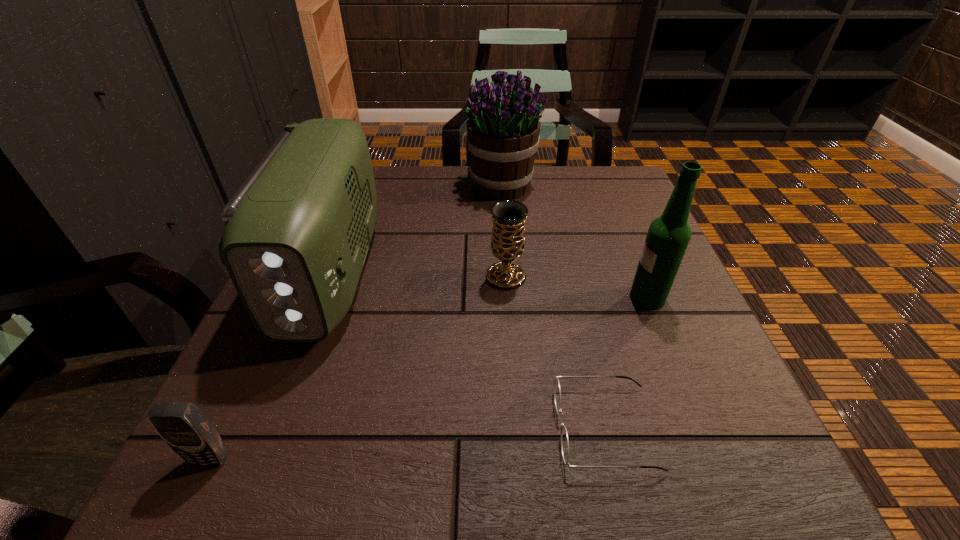
Locate an element on the screen. This screenshot has width=960, height=540. free spot located on the front-facing side of the radio_receiver is located at coordinates coord(279,407).

Where is `free space located 0.060m on the left of the fourth tallest object`? The image size is (960, 540). free space located 0.060m on the left of the fourth tallest object is located at coordinates (456, 276).

Locate an element on the screen. free space located on the front-facing side of the spectacles is located at coordinates (507, 428).

I want to click on free region located 0.250m on the front-facing side of the spectacles, so click(383, 428).

Find the location of a particular element. vacant space located 0.160m on the front-facing side of the spectacles is located at coordinates (445, 428).

Where is `bouquet present at the far edge`? bouquet present at the far edge is located at coordinates (503, 128).

At what (x,y) coordinates should I click in order to perform the action: click on radio_receiver located at the far edge. Please return your answer as a coordinate pair (x, y). This screenshot has height=540, width=960. Looking at the image, I should click on (297, 232).

In order to click on cellular telephone at the near edge in this screenshot , I will do `click(181, 425)`.

Locate an element on the screen. This screenshot has height=540, width=960. spectacles that is positioned at the near edge is located at coordinates (557, 391).

Locate an element on the screen. radio_receiver located at the left edge is located at coordinates (297, 232).